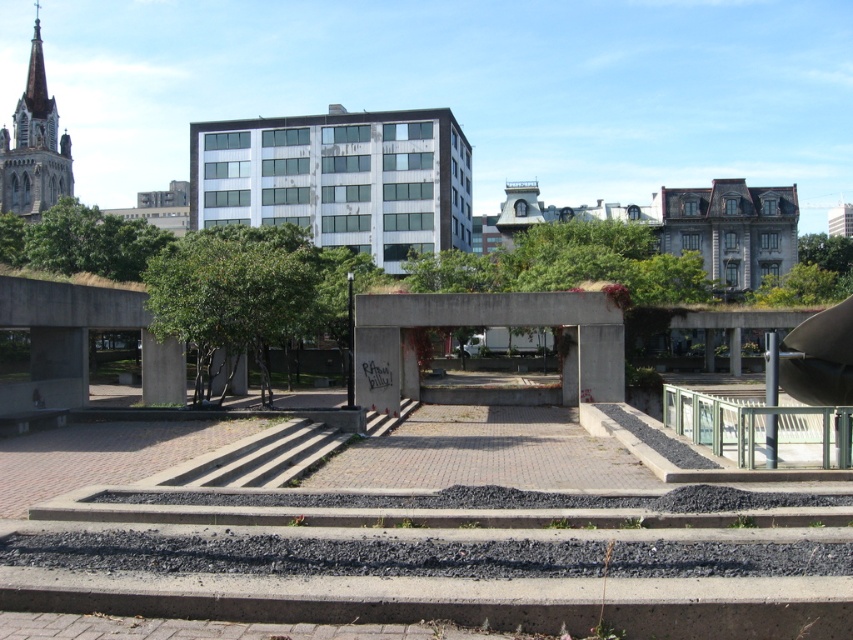
You are standing in the urban plaza described. You want to take a photo of the green leafy tree at center. If your camera can focus on objects up to 20 meters away, will you be able to capture a clear photo of the tree?

The green leafy tree at center is 21.19 meters away from you, which is beyond the camera focus range of 20 meters. Therefore, you won cannot capture a clear photo of the tree with this camera.

You are standing in the urban plaza and see two green leafy trees. One is labeled as the green leafy tree at center and the other as the green leafy tree at upper right. Which tree is located more to the left when facing the plaza?

The green leafy tree at center is positioned on the left side of the green leafy tree at upper right, so it is more to the left.

You are standing in the plaza and want to take a photo of both the green leafy tree at upper left and the green leafy tree at upper right. Which direction should you face to include both trees in your frame?

You should face towards the center of the plaza between the green leafy tree at upper left and the green leafy tree at upper right, as the green leafy tree at upper left is positioned to the left of the green leafy tree at upper right.